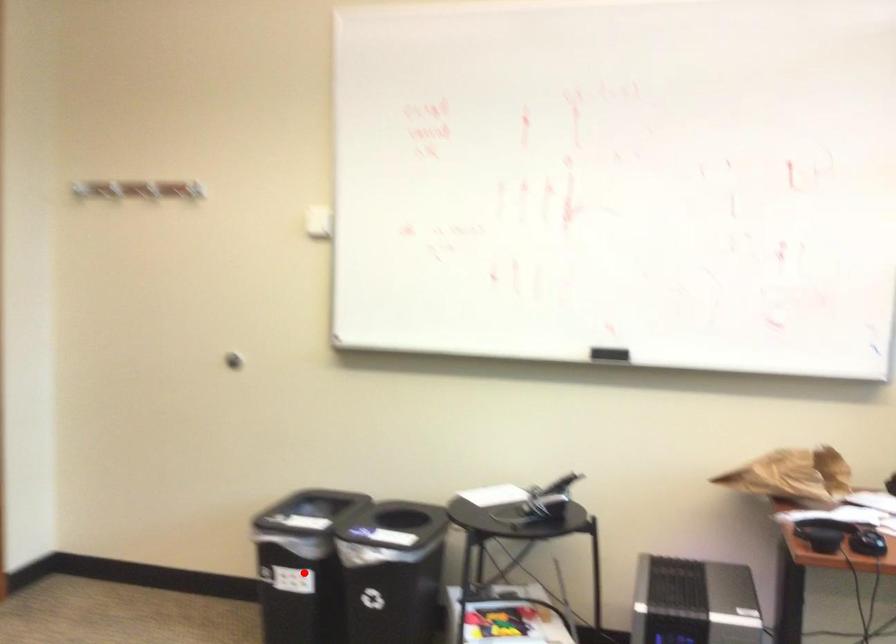
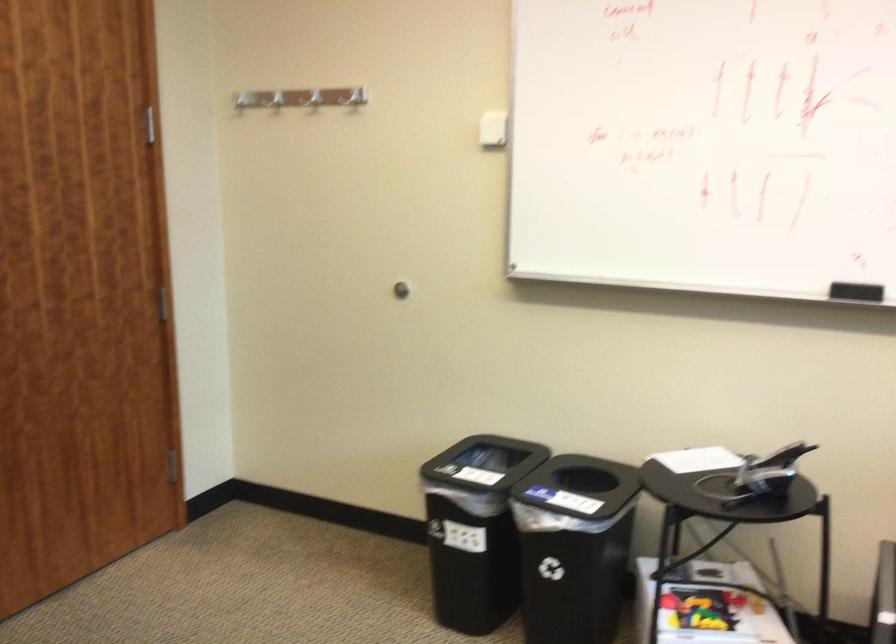
Find the pixel in the second image that matches the highlighted location in the first image.

(475, 529)